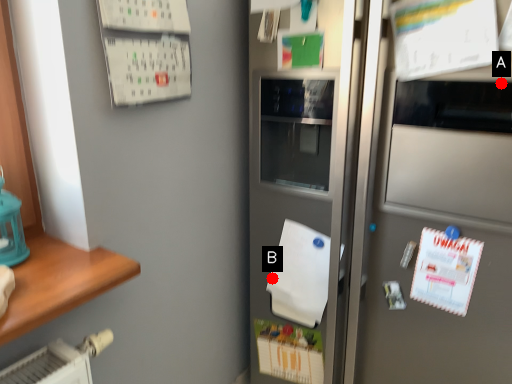
Question: Two points are circled on the image, labeled by A and B beside each circle. Which of the following is the closest to the observer?

Choices:
 (A) A is closer
 (B) B is closer

Answer: (A)